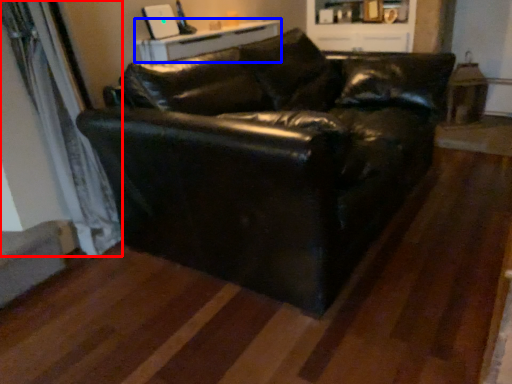
Question: Which object is further to the camera taking this photo, curtain (highlighted by a red box) or table (highlighted by a blue box)?

Choices:
 (A) curtain
 (B) table

Answer: (B)